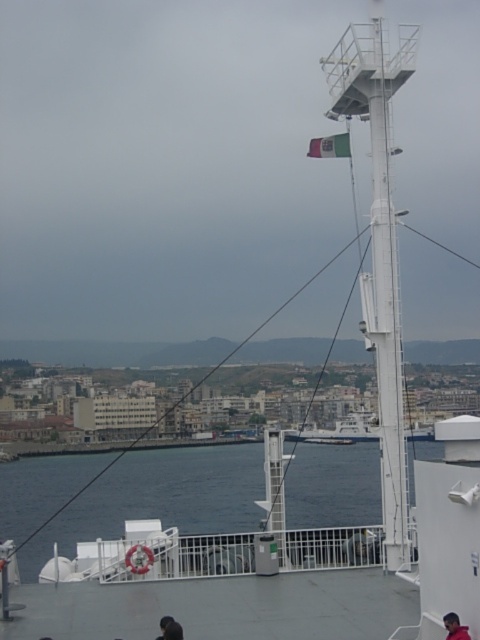
Does white metallic mast at upper center have a greater height compared to dark hair at lower center?

Yes.

Identify the location of white metallic mast at upper center. The width and height of the screenshot is (480, 640). (380, 244).

Describe the element at coordinates (380, 244) in the screenshot. I see `white metallic mast at upper center` at that location.

At what (x,y) coordinates should I click in order to perform the action: click on white metallic mast at upper center. Please return your answer as a coordinate pair (x, y). The image size is (480, 640). Looking at the image, I should click on (380, 244).

Who is shorter, blue water at center or white metallic mast at upper center?

white metallic mast at upper center

Where is `blue water at center`? This screenshot has height=640, width=480. blue water at center is located at coordinates (159, 499).

Is point (356, 516) positioned after point (379, 19)?

Yes, point (356, 516) is farther from viewer.

Find the location of a particular element. The image size is (480, 640). blue water at center is located at coordinates (159, 499).

Looking at this image, is blue water at center closer to the viewer compared to dark hair at lower center?

No, blue water at center is further to the viewer.

Image resolution: width=480 pixels, height=640 pixels. In order to click on blue water at center in this screenshot , I will do `click(159, 499)`.